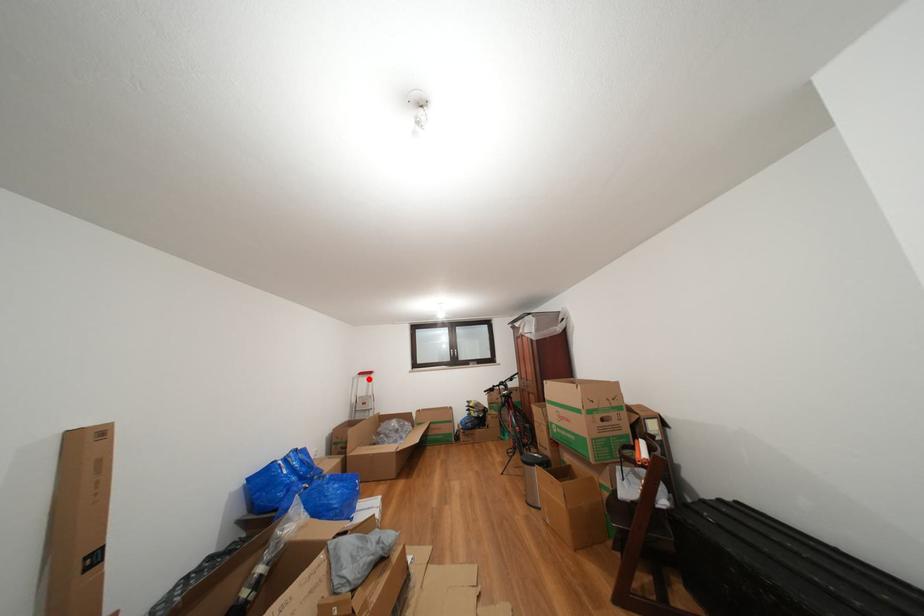
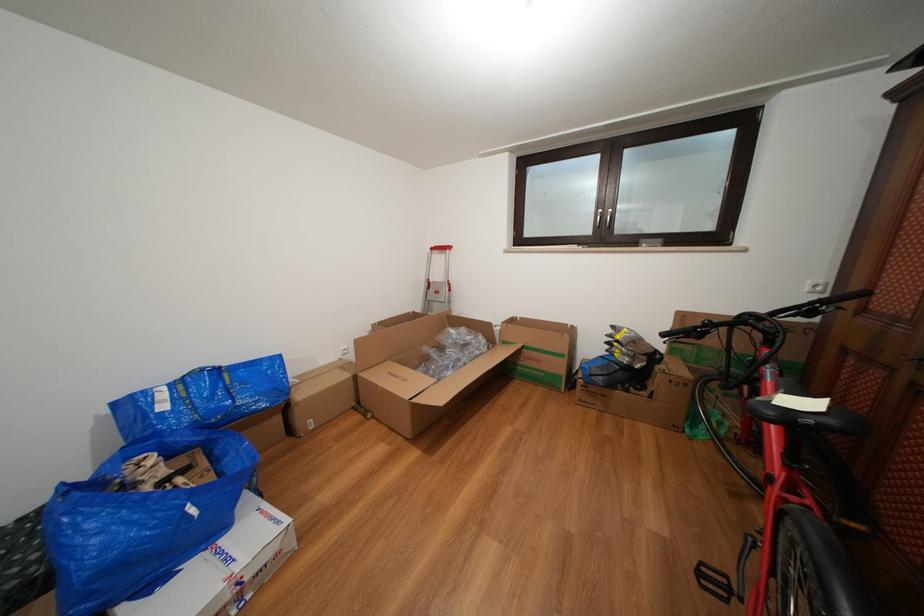
In the second image, find the point that corresponds to the highlighted location in the first image.

(441, 254)